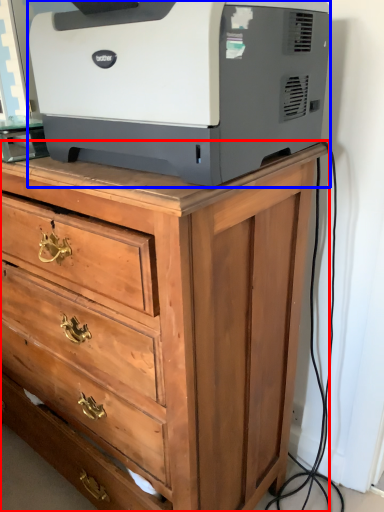
Question: Which object appears farthest to the camera in this image, chest of drawers (highlighted by a red box) or printer (highlighted by a blue box)?

Choices:
 (A) chest of drawers
 (B) printer

Answer: (A)